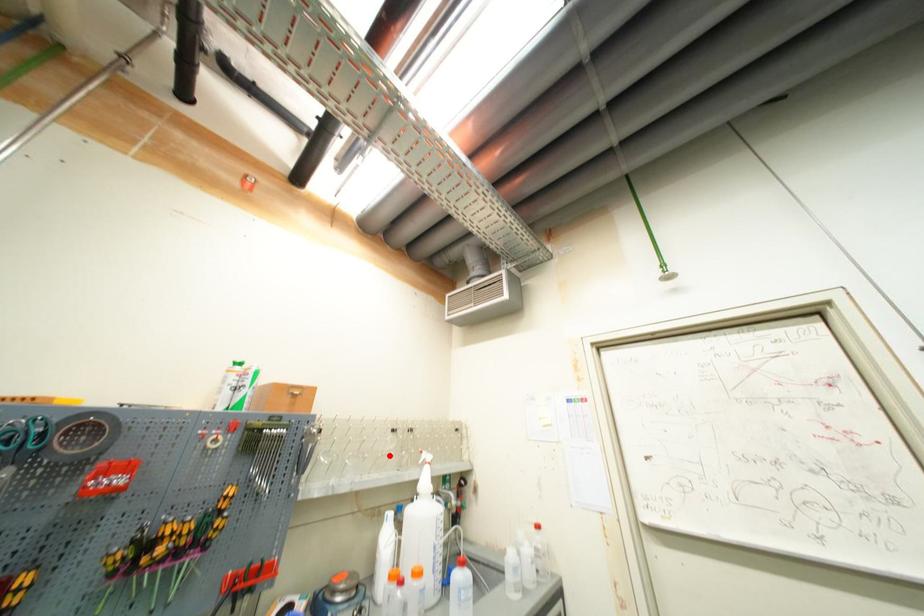
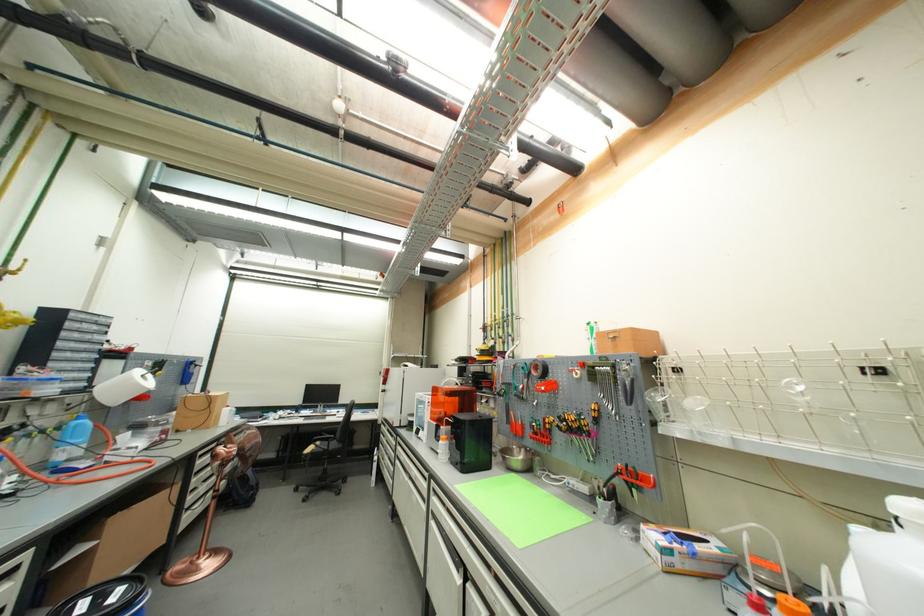
Question: I am providing you with two images of the same scene from different viewpoints. A red point is shown in image1. For the corresponding object point in image2, is it positioned nearer or farther from the camera?

Choices:
 (A) Nearer
 (B) Farther

Answer: (A)